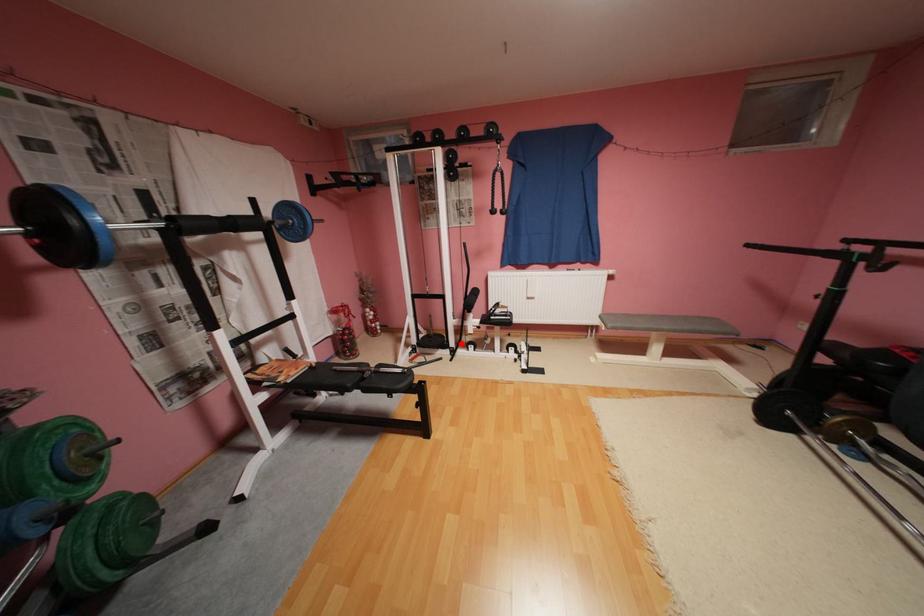
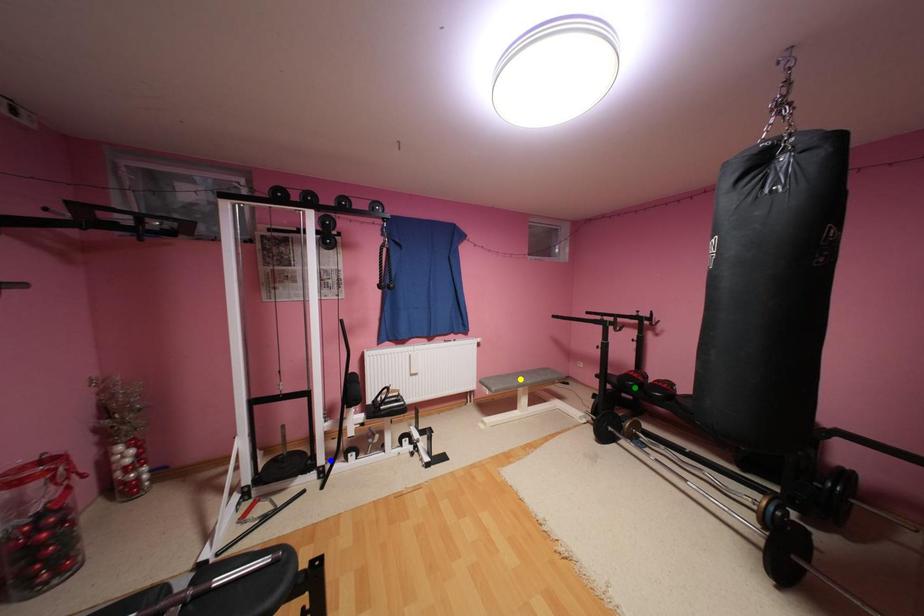
Question: I am providing you with two images of the same scene from different viewpoints. A red point is marked on the first image. You are given multiple points on the second image. Can you choose the point in image 2 that corresponds to the point in image 1?

Choices:
 (A) blue point
 (B) yellow point
 (C) green point

Answer: (A)